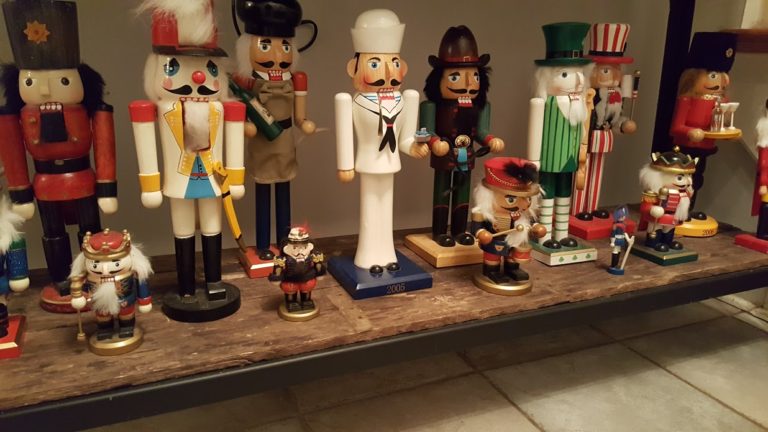
The image size is (768, 432). I want to click on short toys, so click(x=674, y=190), click(x=614, y=248), click(x=512, y=246), click(x=323, y=266), click(x=111, y=304), click(x=24, y=258).